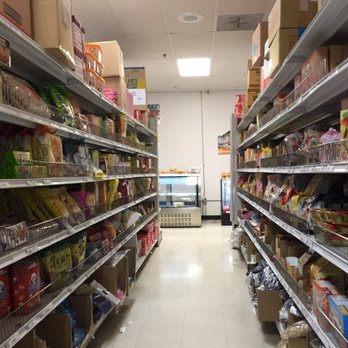
The image size is (348, 348). In order to click on white objects on floor in this screenshot , I will do `click(123, 332)`, `click(131, 325)`.